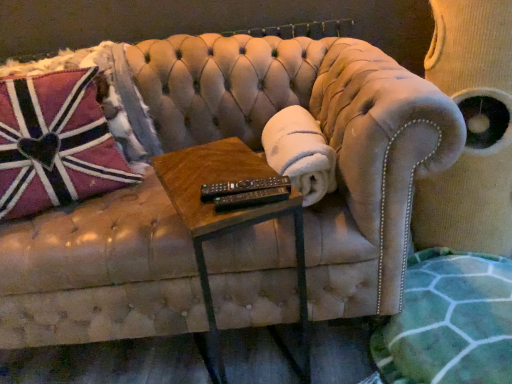
Locate an element on the screen. The image size is (512, 384). vacant space situated on the left part of black plastic remote at center is located at coordinates (196, 198).